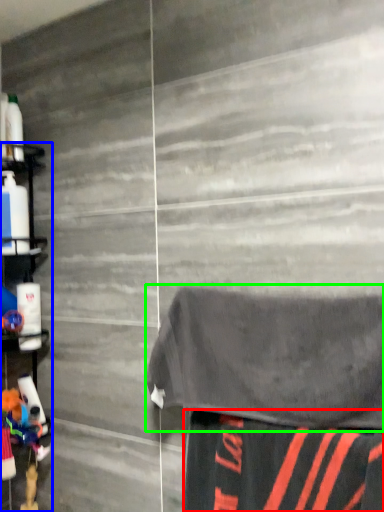
Question: Which object is positioned farthest from fabric (highlighted by a red box)? Select from shelf (highlighted by a blue box) and bath towel (highlighted by a green box).

Choices:
 (A) shelf
 (B) bath towel

Answer: (A)